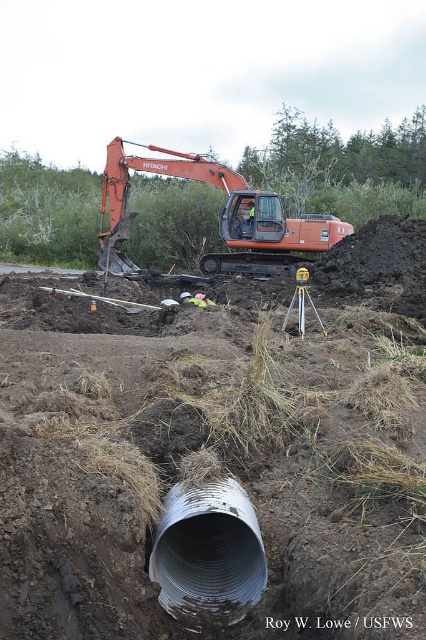
Question: Does smooth brown dirt at center have a larger size compared to green fabric construction worker at center?

Choices:
 (A) yes
 (B) no

Answer: (A)

Question: Considering the real-world distances, which object is closest to the orange metallic excavator at center?

Choices:
 (A) smooth brown dirt at center
 (B) reflective safety vest at center
 (C) green fabric construction worker at center
 (D) yellow plastic tripod at center

Answer: (B)

Question: Which object is the closest to the yellow plastic tripod at center?

Choices:
 (A) orange metallic excavator at center
 (B) smooth brown dirt at center

Answer: (B)

Question: Observing the image, what is the correct spatial positioning of yellow plastic tripod at center in reference to reflective safety vest at center?

Choices:
 (A) right
 (B) left

Answer: (A)

Question: Which of the following is the farthest from the observer?

Choices:
 (A) green fabric construction worker at center
 (B) smooth brown dirt at center
 (C) reflective safety vest at center

Answer: (C)

Question: Is the position of silver corrugated pipe at center more distant than that of yellow plastic tripod at center?

Choices:
 (A) yes
 (B) no

Answer: (B)